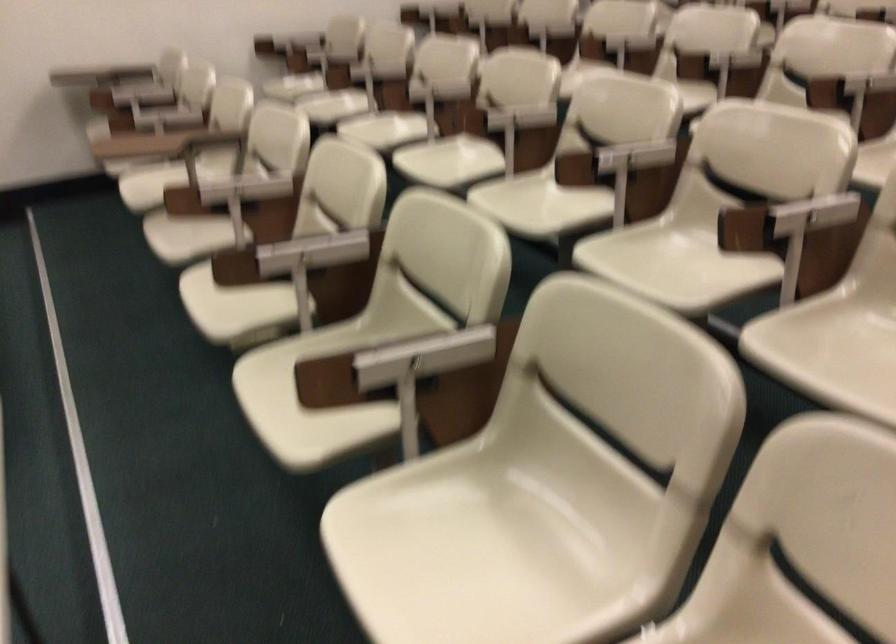
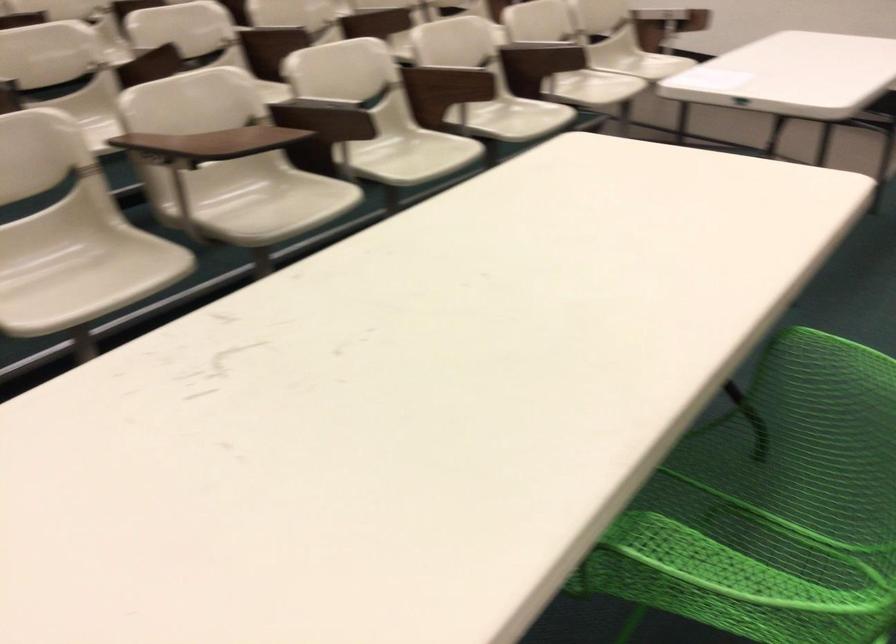
Find the pixel in the second image that matches [410,348] in the first image.

(543, 49)